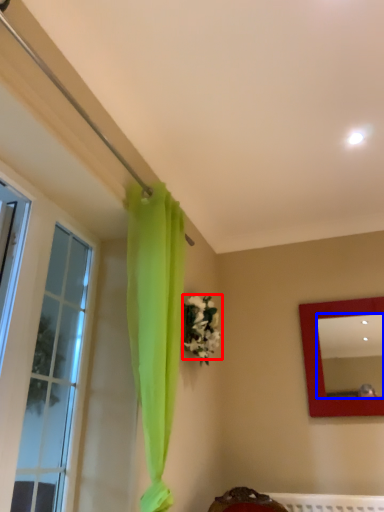
Question: Which of the following is the closest to the observer, flower (highlighted by a red box) or mirror (highlighted by a blue box)?

Choices:
 (A) flower
 (B) mirror

Answer: (A)